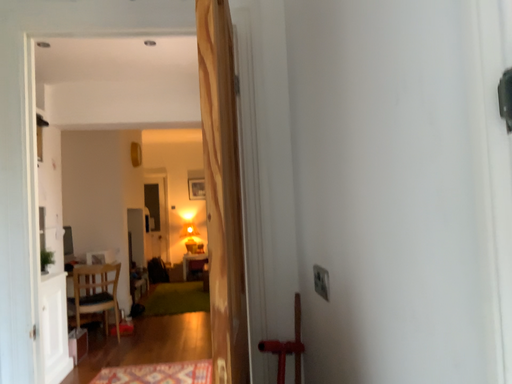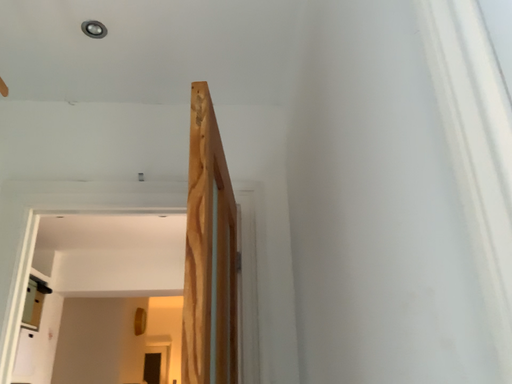
Question: How did the camera likely rotate when shooting the video?

Choices:
 (A) rotated downward
 (B) rotated upward

Answer: (B)